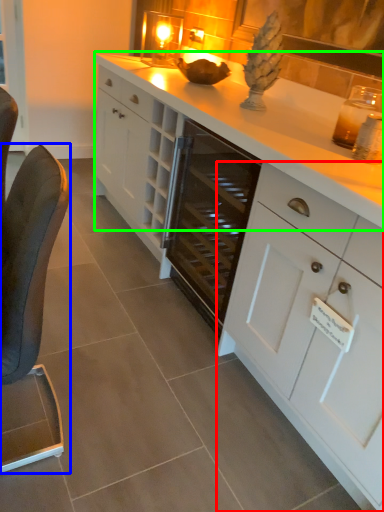
Question: Which object is positioned closest to cabinetry (highlighted by a red box)? Select from furniture (highlighted by a blue box) and countertop (highlighted by a green box).

Choices:
 (A) furniture
 (B) countertop

Answer: (B)